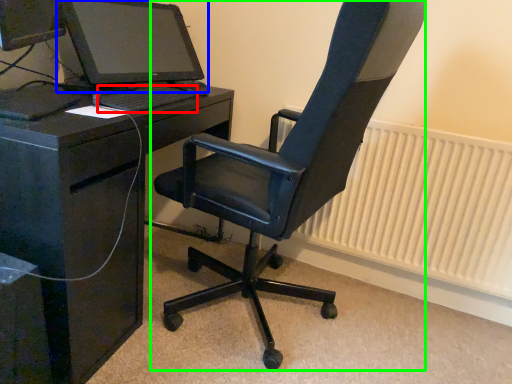
Question: Considering the real-world distances, which object is farthest from computer keyboard (highlighted by a red box)? computer monitor (highlighted by a blue box) or chair (highlighted by a green box)?

Choices:
 (A) computer monitor
 (B) chair

Answer: (B)